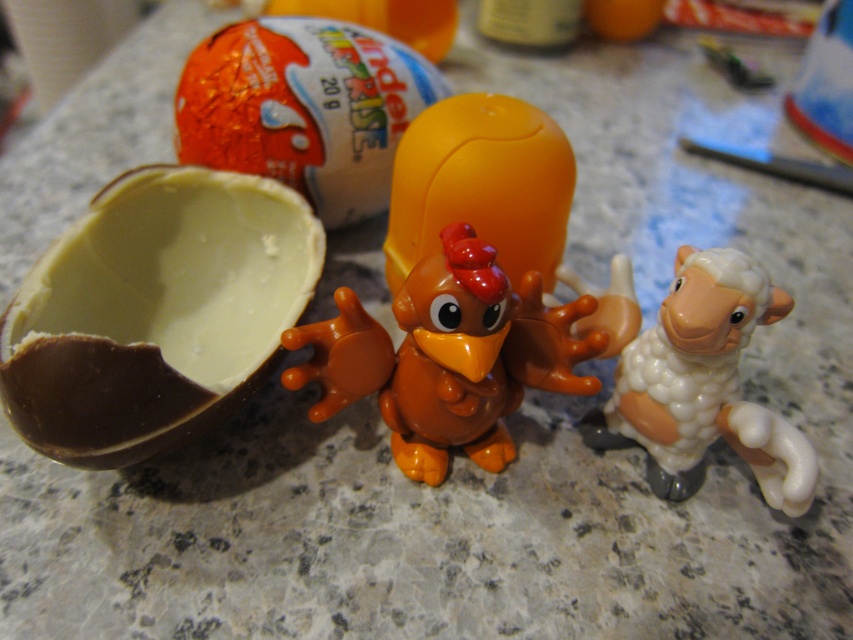
Question: Which point is farther to the camera?

Choices:
 (A) (643, 385)
 (B) (351, 184)

Answer: (B)

Question: Considering the relative positions of smooth chocolate egg at center and shiny chocolate egg at center in the image provided, where is smooth chocolate egg at center located with respect to shiny chocolate egg at center?

Choices:
 (A) right
 (B) left

Answer: (B)

Question: Which of the following is the farthest from the observer?

Choices:
 (A) pos(115,384)
 (B) pos(401,378)
 (C) pos(677,465)
 (D) pos(229,136)

Answer: (D)

Question: Is shiny chocolate egg at center to the left of white glossy sheep at right from the viewer's perspective?

Choices:
 (A) no
 (B) yes

Answer: (B)

Question: Can you confirm if orange matte plastic chicken at center is positioned to the right of white glossy sheep at right?

Choices:
 (A) no
 (B) yes

Answer: (A)

Question: Which of the following is the closest to the observer?

Choices:
 (A) click(x=492, y=276)
 (B) click(x=171, y=259)
 (C) click(x=334, y=154)

Answer: (A)